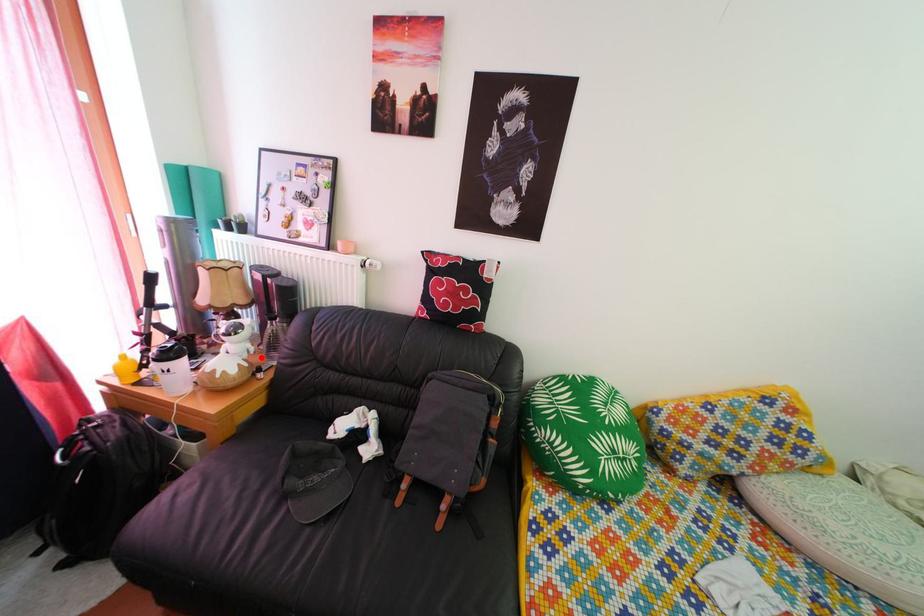
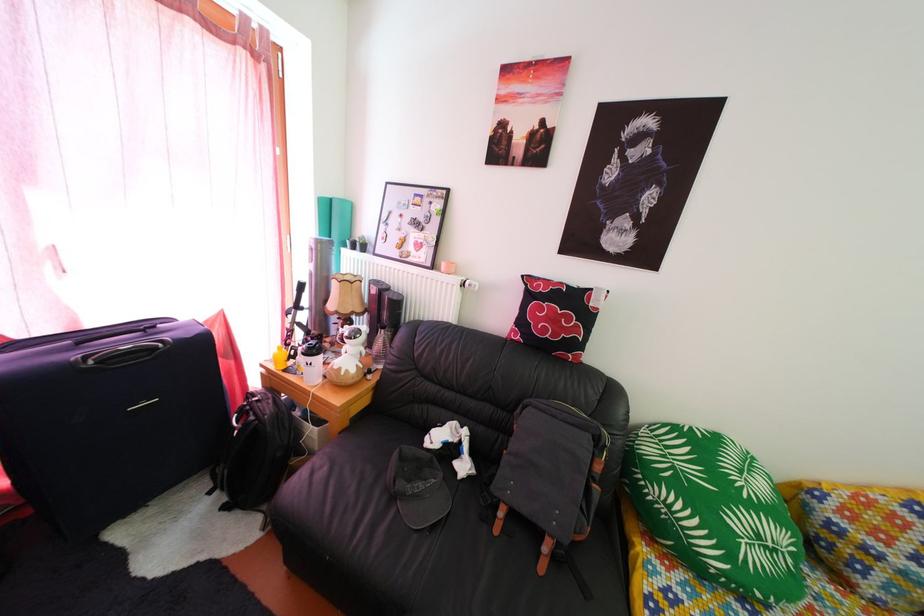
The point at the highlighted location is marked in the first image. Where is the corresponding point in the second image?

(372, 361)